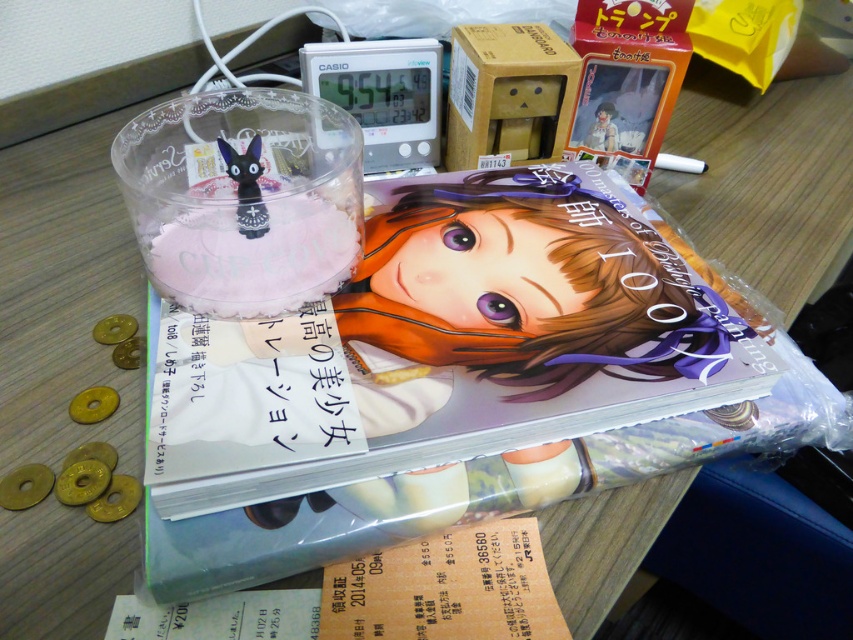
You are organizing items on a desk and need to place a small decorative item between the yellow matte coin at lower left and the matte plastic figurine at upper right. What is the minimum distance you need to maintain between them to ensure the decorative item fits?

The minimum distance required is 21.07 inches, as the space between the yellow matte coin at lower left and the matte plastic figurine at upper right is exactly that measurement.

You are organizing the items on the desk and notice the matte black cat figurine at upper left and the yellow matte coin at lower left. Which item is placed higher up on the desk?

The matte black cat figurine at upper left is positioned over yellow matte coin at lower left, so it is placed higher up on the desk.